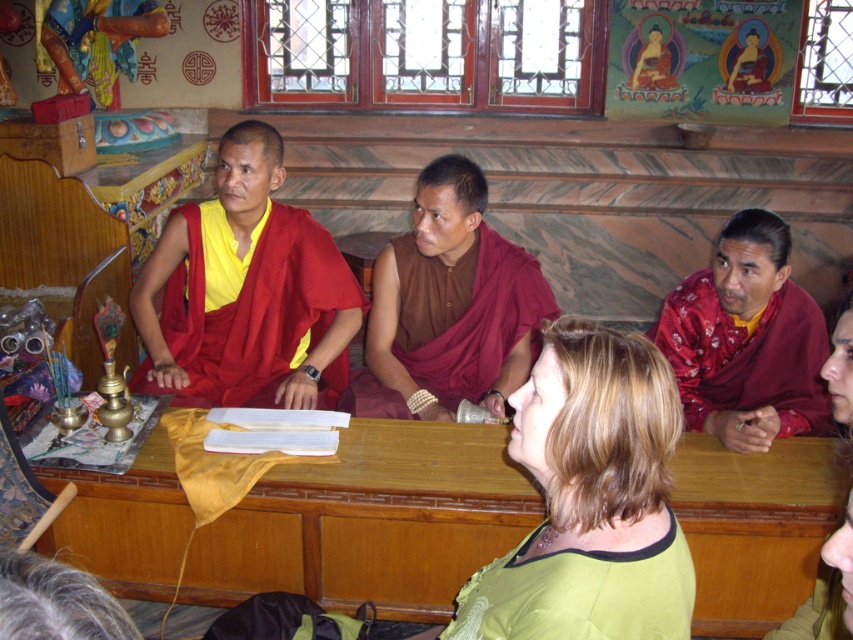
Is matte red robe at center thinner than brown silk robe at center?

In fact, matte red robe at center might be wider than brown silk robe at center.

The width and height of the screenshot is (853, 640). What do you see at coordinates (245, 292) in the screenshot?
I see `matte red robe at center` at bounding box center [245, 292].

Between point (312, 292) and point (474, 280), which one is positioned in front?

Positioned in front is point (474, 280).

Where is `matte red robe at center`? The image size is (853, 640). matte red robe at center is located at coordinates (245, 292).

From the picture: Between wooden table at center and red silk robe at right, which one has more height?

Standing taller between the two is red silk robe at right.

The image size is (853, 640). In order to click on wooden table at center in this screenshot , I will do `click(370, 522)`.

Where is `wooden table at center`? Image resolution: width=853 pixels, height=640 pixels. wooden table at center is located at coordinates (370, 522).

Between matte red robe at center and red silk robe at right, which one has less height?

With less height is red silk robe at right.

Measure the distance between matte red robe at center and camera.

The distance of matte red robe at center from camera is 2.59 meters.

Identify the location of matte red robe at center. The image size is (853, 640). (245, 292).